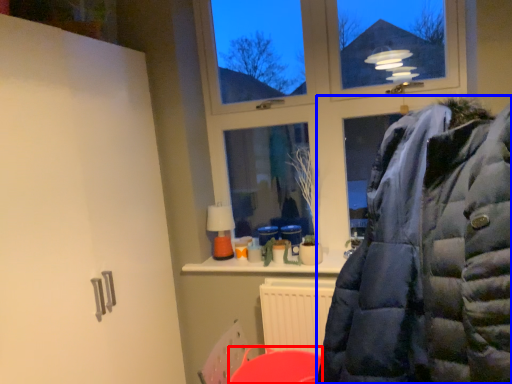
Question: Which of the following is the farthest to the observer, table (highlighted by a red box) or jacket (highlighted by a blue box)?

Choices:
 (A) table
 (B) jacket

Answer: (A)